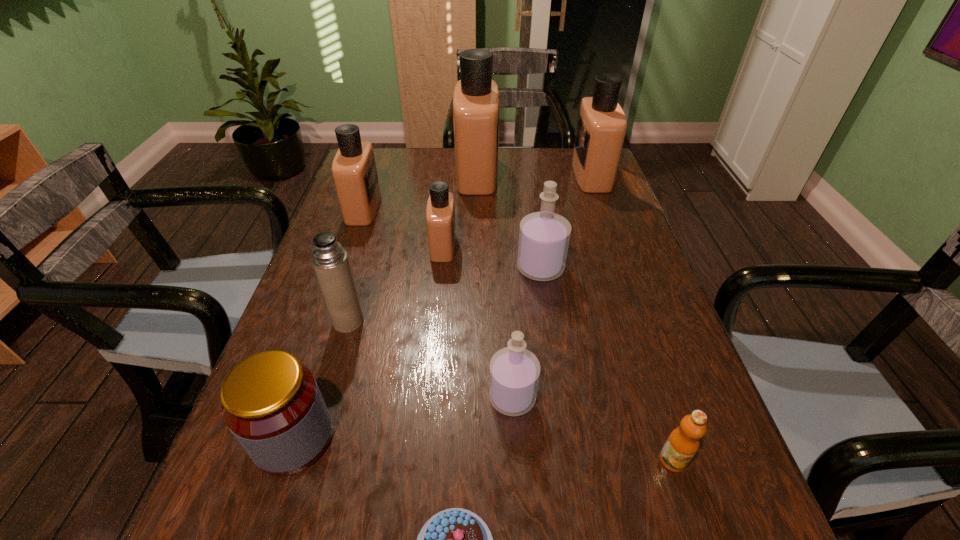
The height and width of the screenshot is (540, 960). What are the coordinates of `unoccupied position between the second tallest object and the second shortest object` in the screenshot? It's located at (632, 318).

Find the location of a particular element. This screenshot has height=540, width=960. object that is the ninth nearest to the nearest object is located at coordinates (601, 128).

What are the coordinates of `object that is the fourth closest to the tallest perfume` in the screenshot? It's located at (544, 236).

I want to click on the second closest perfume to the farther purple perfume, so click(514, 372).

Find the location of `the second closest perfume to the red jar`. the second closest perfume to the red jar is located at coordinates (440, 213).

Locate an element on the screen. This screenshot has height=540, width=960. beige perfume that can be found as the fourth closest to the ninth tallest object is located at coordinates (354, 171).

Locate which beige perfume ranks fourth in proximity to the smaller purple perfume. Please provide its 2D coordinates. Your answer should be formatted as a tuple, i.e. [(x, y)], where the tuple contains the x and y coordinates of a point satisfying the conditions above.

[(601, 128)]

You are a GUI agent. You are given a task and a screenshot of the screen. Output one action in this format:
    pyautogui.click(x=<x>, y=<y>)
    Task: Click on the vacant space that satisfies the following two spatial constraints: 1. on the front label of the nearer purple perfume; 2. on the right side of the tallest object
    
    Given the screenshot: What is the action you would take?
    pyautogui.click(x=474, y=397)

Where is `vacant space that satisfies the following two spatial constraints: 1. on the front label of the second smallest beige perfume; 2. on the right side of the bigger purple perfume`? This screenshot has width=960, height=540. vacant space that satisfies the following two spatial constraints: 1. on the front label of the second smallest beige perfume; 2. on the right side of the bigger purple perfume is located at coordinates (343, 268).

This screenshot has height=540, width=960. What are the coordinates of `free space in the image that satisfies the following two spatial constraints: 1. on the front label of the leftmost beige perfume; 2. on the right side of the nearer purple perfume` in the screenshot? It's located at 300,397.